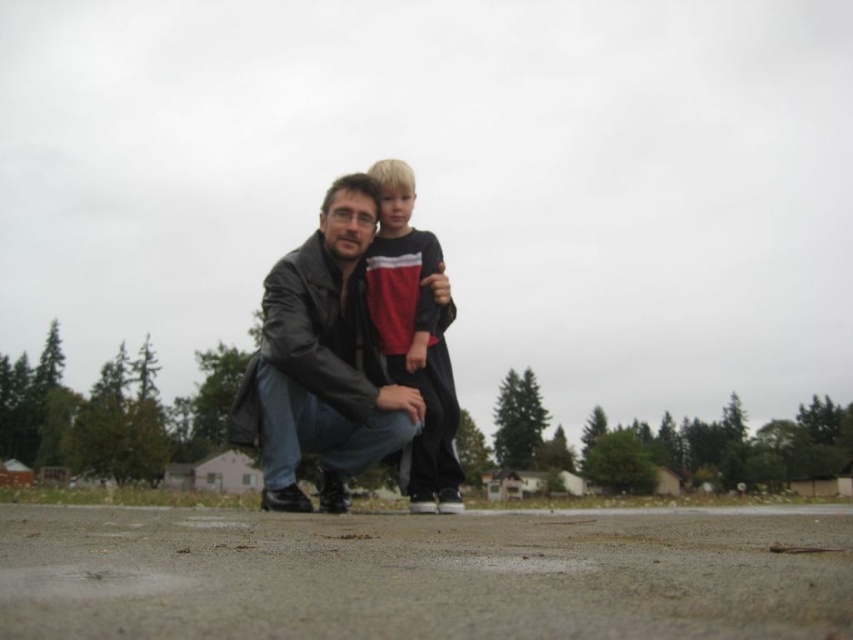
Can you confirm if leather jacket at center is positioned to the left of matte black shirt at center?

Correct, you'll find leather jacket at center to the left of matte black shirt at center.

Identify the location of leather jacket at center. (322, 362).

Find the location of `leather jacket at center`. leather jacket at center is located at coordinates (322, 362).